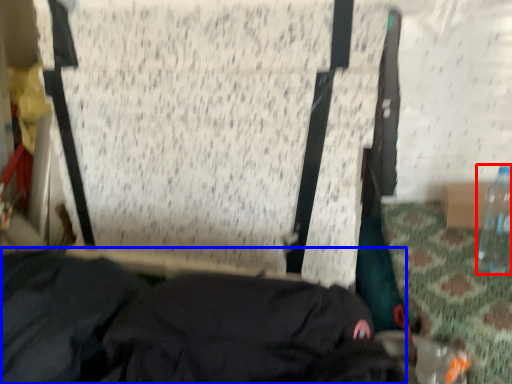
Question: Which of the following is the closest to the observer, bottle (highlighted by a red box) or clothing (highlighted by a blue box)?

Choices:
 (A) bottle
 (B) clothing

Answer: (B)